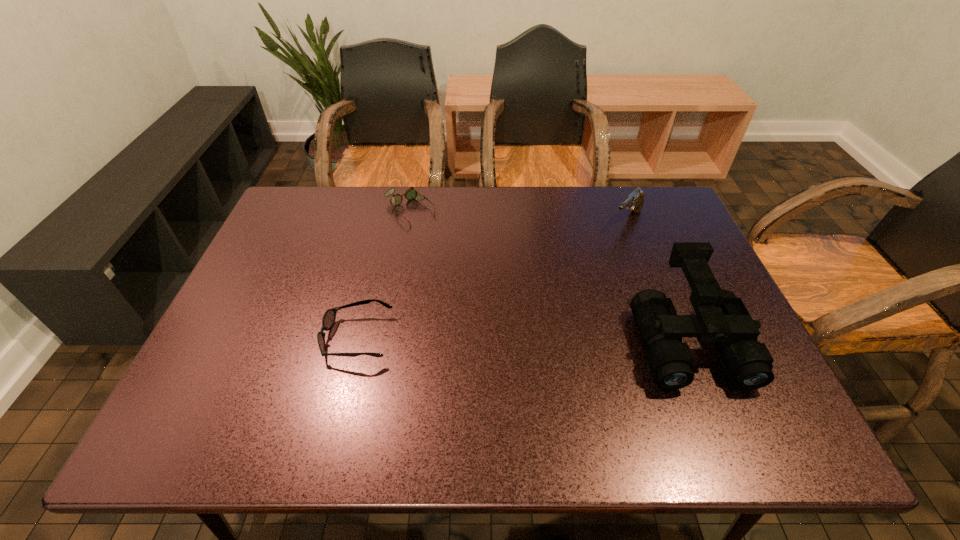
Identify the location of sunglasses. This screenshot has width=960, height=540. (329, 317).

At what (x,y) coordinates should I click in order to perform the action: click on the tallest object. Please return your answer as a coordinate pair (x, y). Image resolution: width=960 pixels, height=540 pixels. Looking at the image, I should click on (722, 318).

The image size is (960, 540). I want to click on pistol, so click(x=634, y=202).

The image size is (960, 540). What are the coordinates of `spectacles` in the screenshot? It's located at (410, 194).

The image size is (960, 540). I want to click on vacant space located 0.080m on the lenses of the sunglasses, so click(x=290, y=338).

Identify the location of vacant position located 0.110m on the lenses of the sunglasses. (277, 338).

Find the location of a particular element. This screenshot has height=540, width=960. vacant area situated 0.160m on the lenses of the sunglasses is located at coordinates (255, 338).

The width and height of the screenshot is (960, 540). I want to click on free space located at the barrel of the second tallest object, so click(587, 263).

Find the location of a particular element. vacant space located 0.310m at the barrel of the second tallest object is located at coordinates (562, 289).

The image size is (960, 540). Find the location of `free location located 0.340m at the barrel of the second tallest object`. free location located 0.340m at the barrel of the second tallest object is located at coordinates (555, 295).